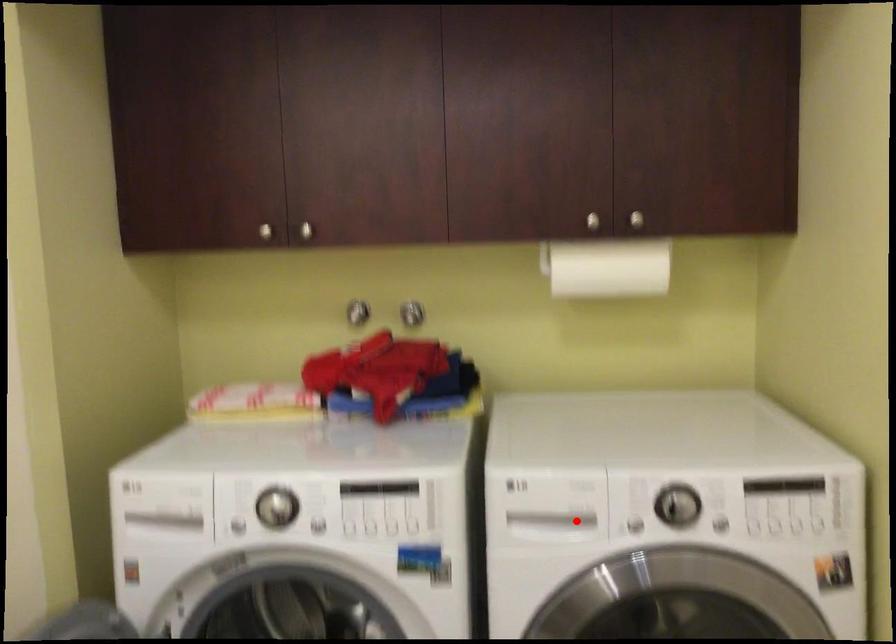
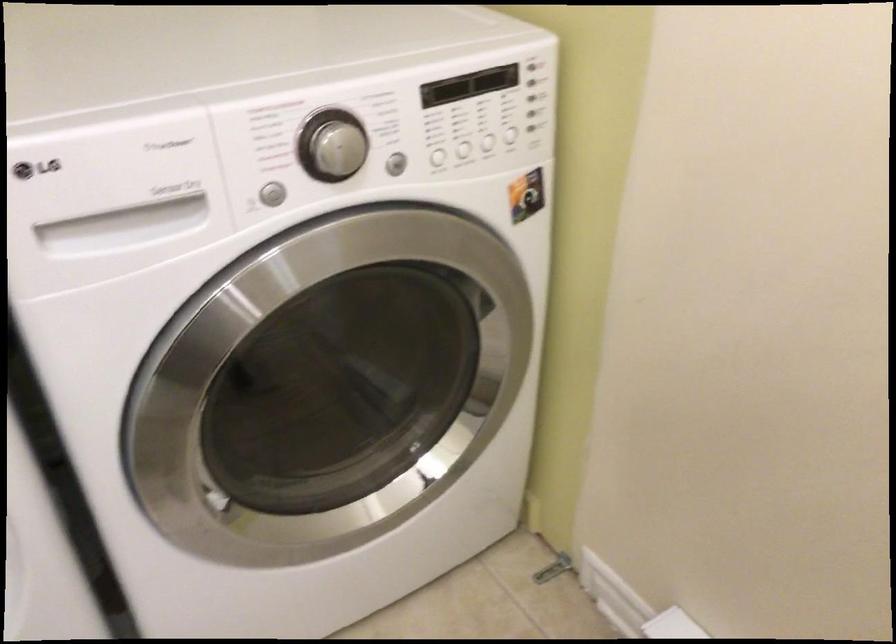
In the second image, find the point that corresponds to the highlighted location in the first image.

(164, 210)